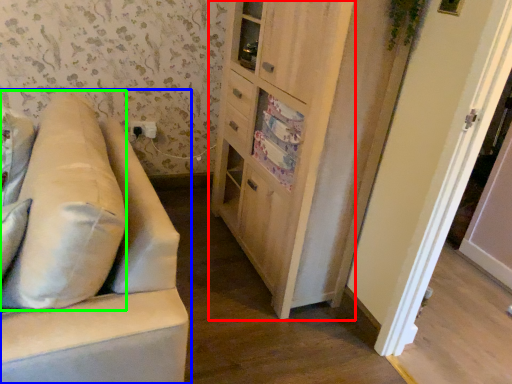
Question: Which object is the farthest from cabinetry (highlighted by a red box)? Choose among these: studio couch (highlighted by a blue box) or pillow (highlighted by a green box).

Choices:
 (A) studio couch
 (B) pillow

Answer: (B)